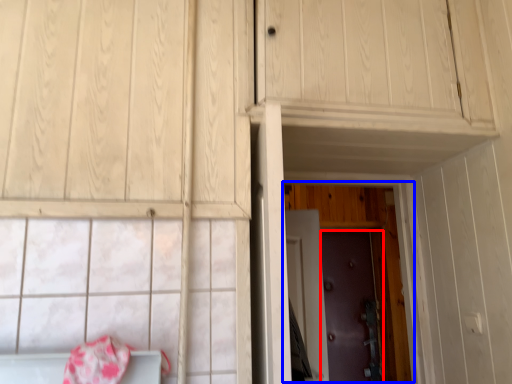
Question: Among these objects, which one is nearest to the camera, door (highlighted by a red box) or door (highlighted by a blue box)?

Choices:
 (A) door
 (B) door

Answer: (B)